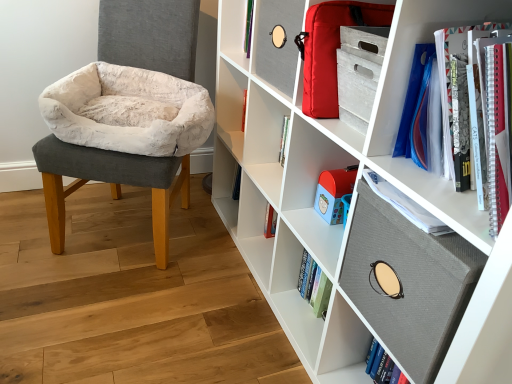
Question: Is textured gray board at upper right, which is counted as the first cabinet, starting from the bottom, directly adjacent to white matte bookshelf at center, which is counted as the 3th shelf, starting from the bottom?

Choices:
 (A) yes
 (B) no

Answer: (B)

Question: From a real-world perspective, does textured gray board at upper right, which is counted as the first cabinet, starting from the bottom, sit lower than white matte bookshelf at center, which is counted as the 3th shelf, starting from the bottom?

Choices:
 (A) yes
 (B) no

Answer: (B)

Question: From the image's perspective, is textured gray board at upper right, which ranks as the 2th cabinet in top-to-bottom order, beneath white matte bookshelf at center, the 1th shelf when ordered from top to bottom?

Choices:
 (A) no
 (B) yes

Answer: (B)

Question: Could you tell me if textured gray board at upper right, which is counted as the first cabinet, starting from the bottom, is turned towards white matte bookshelf at center, which is counted as the 3th shelf, starting from the bottom?

Choices:
 (A) no
 (B) yes

Answer: (A)

Question: Is textured gray board at upper right, which ranks as the 2th cabinet in top-to-bottom order, completely or partially outside of white matte bookshelf at center, which is counted as the 3th shelf, starting from the bottom?

Choices:
 (A) no
 (B) yes

Answer: (B)

Question: Which is correct: white fabric bookshelf at upper right, arranged as the 1th shelf when ordered from the bottom, is inside textured gray board at upper right, which is counted as the first cabinet, starting from the bottom, or outside of it?

Choices:
 (A) outside
 (B) inside

Answer: (A)

Question: Is white fabric bookshelf at upper right, which is the third shelf in top-to-bottom order, wider or thinner than textured gray board at upper right, which ranks as the 2th cabinet in top-to-bottom order?

Choices:
 (A) wide
 (B) thin

Answer: (A)

Question: Is white fabric bookshelf at upper right, which is the third shelf in top-to-bottom order, in front of or behind textured gray board at upper right, which ranks as the 2th cabinet in top-to-bottom order, in the image?

Choices:
 (A) behind
 (B) front

Answer: (B)

Question: Is white fabric bookshelf at upper right, which is the third shelf in top-to-bottom order, to the left or to the right of textured gray board at upper right, which is counted as the first cabinet, starting from the bottom, in the image?

Choices:
 (A) left
 (B) right

Answer: (A)

Question: Is white fabric bookshelf at upper right, arranged as the 1th shelf when ordered from the bottom, in front of or behind white plush cushion at left in the image?

Choices:
 (A) behind
 (B) front

Answer: (B)

Question: Considering the positions of white fabric bookshelf at upper right, arranged as the 1th shelf when ordered from the bottom, and white plush cushion at left in the image, is white fabric bookshelf at upper right, arranged as the 1th shelf when ordered from the bottom, taller or shorter than white plush cushion at left?

Choices:
 (A) short
 (B) tall

Answer: (B)

Question: Choose the correct answer: Is white fabric bookshelf at upper right, arranged as the 1th shelf when ordered from the bottom, inside white plush cushion at left or outside it?

Choices:
 (A) inside
 (B) outside

Answer: (B)

Question: Would you say white fabric bookshelf at upper right, which is the third shelf in top-to-bottom order, is to the left or to the right of white plush cushion at left in the picture?

Choices:
 (A) right
 (B) left

Answer: (A)

Question: From a real-world perspective, is white matte bookshelf at center, the 1th shelf when ordered from top to bottom, positioned above or below matte red bag at upper right, which ranks as the second cabinet in bottom-to-top order?

Choices:
 (A) above
 (B) below

Answer: (B)

Question: Is white matte bookshelf at center, which is counted as the 3th shelf, starting from the bottom, wider or thinner than matte red bag at upper right, which ranks as the second cabinet in bottom-to-top order?

Choices:
 (A) wide
 (B) thin

Answer: (B)